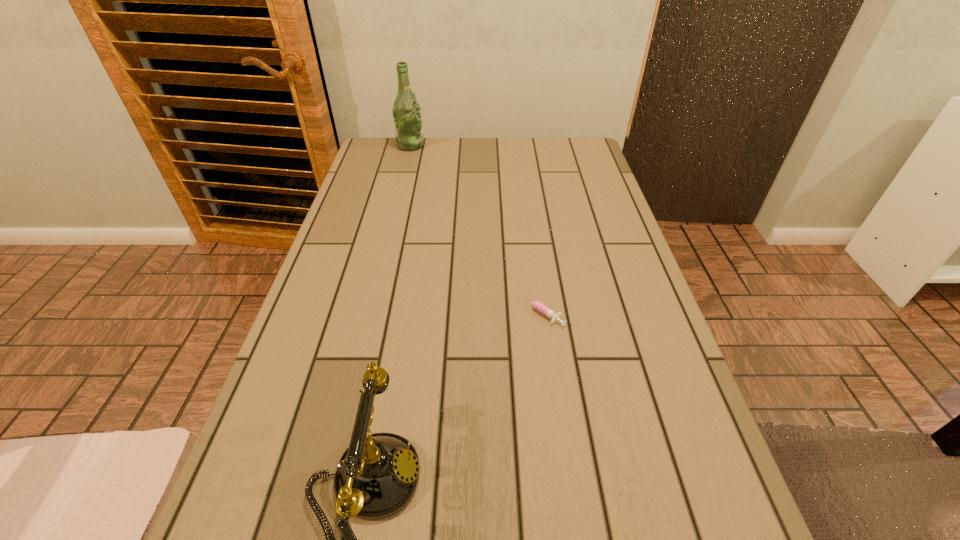
The image size is (960, 540). Find the location of `beer bottle`. beer bottle is located at coordinates (x=406, y=111).

This screenshot has width=960, height=540. I want to click on the farthest object, so click(406, 111).

You are a GUI agent. You are given a task and a screenshot of the screen. Output one action in this format:
    pyautogui.click(x=<x>, y=<y>)
    Task: Click on the syringe
    The image size is (960, 540).
    Given the screenshot: What is the action you would take?
    [x=537, y=305]

Locate an element on the screen. the rightmost object is located at coordinates (537, 305).

The image size is (960, 540). I want to click on free space located on the surface of the farthest object, so click(515, 145).

Locate an element on the screen. This screenshot has height=540, width=960. free space located 0.370m on the left of the syringe is located at coordinates (348, 312).

Where is `object present at the far edge`? The image size is (960, 540). object present at the far edge is located at coordinates (406, 111).

Where is `object situated at the left edge`? The height and width of the screenshot is (540, 960). object situated at the left edge is located at coordinates (406, 111).

At what (x,y) coordinates should I click in order to perform the action: click on object that is at the far left corner. Please return your answer as a coordinate pair (x, y). Looking at the image, I should click on click(x=406, y=111).

In the image, there is a desktop. What are the coordinates of `vacant space at the far edge` in the screenshot? It's located at (458, 154).